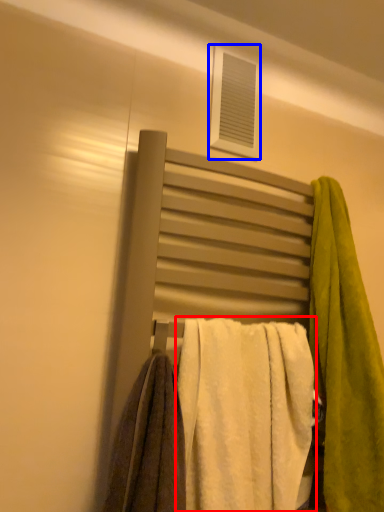
Question: Which of the following is the closest to the observer, towel (highlighted by a red box) or window (highlighted by a blue box)?

Choices:
 (A) towel
 (B) window

Answer: (A)